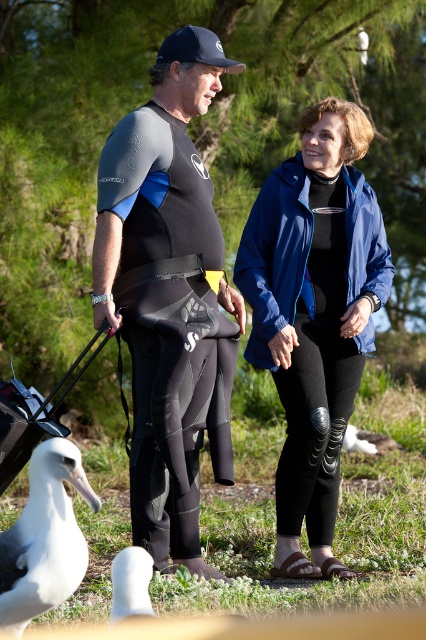
You are standing in the grassy area with scattered white flowers and surrounded by trees. You see two points marked in the image. Which point is closer to you, point (66, 500) or point (106, 337)?

Point (66, 500) is closer to you than point (106, 337).